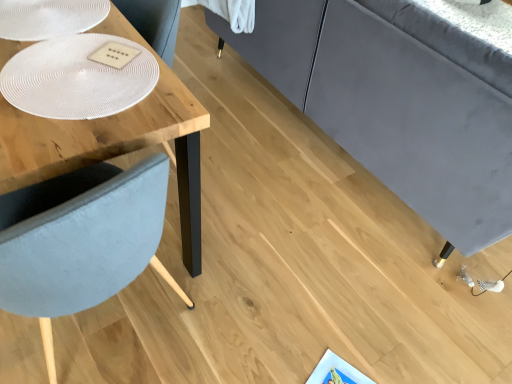
Locate an element on the screen. white textured glass plate at upper left, the 1th glass plate when ordered from top to bottom is located at coordinates (49, 18).

Locate an element on the screen. Image resolution: width=512 pixels, height=384 pixels. white textured glass plate at upper left, marked as the first glass plate in a bottom-to-top arrangement is located at coordinates point(79,77).

This screenshot has width=512, height=384. I want to click on wooden table at left, so click(x=113, y=140).

The width and height of the screenshot is (512, 384). Find the location of `white textured glass plate at upper left, which is the 2th glass plate in bottom-to-top order`. white textured glass plate at upper left, which is the 2th glass plate in bottom-to-top order is located at coordinates (49, 18).

This screenshot has width=512, height=384. In order to click on the 1st glass plate located above the wooden table at left (from a real-world perspective) in this screenshot , I will do `click(49, 18)`.

Is white textured glass plate at upper left, the 1th glass plate when ordered from top to bottom, far from wooden table at left?

Actually, white textured glass plate at upper left, the 1th glass plate when ordered from top to bottom, and wooden table at left are a little close together.

From the image's perspective, which one is positioned higher, white textured glass plate at upper left, which is the 2th glass plate in bottom-to-top order, or wooden table at left?

white textured glass plate at upper left, which is the 2th glass plate in bottom-to-top order, appears higher in the image.

Does white textured glass plate at upper left, the 1th glass plate when ordered from top to bottom, appear on the left side of wooden table at left?

Correct, you'll find white textured glass plate at upper left, the 1th glass plate when ordered from top to bottom, to the left of wooden table at left.

Measure the distance from white textured glass plate at upper left, marked as the first glass plate in a bottom-to-top arrangement, to white textured glass plate at upper left, which is the 2th glass plate in bottom-to-top order.

white textured glass plate at upper left, marked as the first glass plate in a bottom-to-top arrangement, and white textured glass plate at upper left, which is the 2th glass plate in bottom-to-top order, are 8.42 inches apart from each other.

Does white textured glass plate at upper left, marked as the first glass plate in a bottom-to-top arrangement, have a lesser width compared to white textured glass plate at upper left, which is the 2th glass plate in bottom-to-top order?

No.

Considering the positions of objects white textured glass plate at upper left, marked as the second glass plate in a top-to-bottom arrangement, and white textured glass plate at upper left, the 1th glass plate when ordered from top to bottom, in the image provided, who is more to the left, white textured glass plate at upper left, marked as the second glass plate in a top-to-bottom arrangement, or white textured glass plate at upper left, the 1th glass plate when ordered from top to bottom,?

From the viewer's perspective, white textured glass plate at upper left, the 1th glass plate when ordered from top to bottom, appears more on the left side.

Could you tell me if white textured glass plate at upper left, marked as the second glass plate in a top-to-bottom arrangement, is turned towards white textured glass plate at upper left, which is the 2th glass plate in bottom-to-top order?

No, white textured glass plate at upper left, marked as the second glass plate in a top-to-bottom arrangement, does not turn towards white textured glass plate at upper left, which is the 2th glass plate in bottom-to-top order.

Is white textured glass plate at upper left, which is the 2th glass plate in bottom-to-top order, facing away from white textured glass plate at upper left, marked as the first glass plate in a bottom-to-top arrangement?

No, white textured glass plate at upper left, which is the 2th glass plate in bottom-to-top order, is not facing away from white textured glass plate at upper left, marked as the first glass plate in a bottom-to-top arrangement.

Are white textured glass plate at upper left, the 1th glass plate when ordered from top to bottom, and white textured glass plate at upper left, marked as the first glass plate in a bottom-to-top arrangement, making contact?

They are not placed beside each other.

Which is less distant, [88,23] or [24,68]?

Point [88,23].

From a real-world perspective, which object stands above the other?

white textured glass plate at upper left, marked as the second glass plate in a top-to-bottom arrangement, from a real-world perspective.

In the scene shown: Can you tell me how much wooden table at left and white textured glass plate at upper left, marked as the second glass plate in a top-to-bottom arrangement, differ in facing direction?

174 degrees.

Which is behind, wooden table at left or white textured glass plate at upper left, marked as the second glass plate in a top-to-bottom arrangement?

wooden table at left is further from the camera.

Who is bigger, wooden table at left or white textured glass plate at upper left, marked as the first glass plate in a bottom-to-top arrangement?

wooden table at left.

From a real-world perspective, between wooden table at left and white textured glass plate at upper left, which is the 2th glass plate in bottom-to-top order, who is vertically lower?

wooden table at left.

Is point (141, 114) farther from viewer compared to point (47, 1)?

No.

From the image's perspective, is wooden table at left on white textured glass plate at upper left, which is the 2th glass plate in bottom-to-top order?

No, from the image's perspective, wooden table at left is not on top of white textured glass plate at upper left, which is the 2th glass plate in bottom-to-top order.

Who is taller, wooden table at left or white textured glass plate at upper left, the 1th glass plate when ordered from top to bottom?

wooden table at left is taller.

Consider the image. Is white textured glass plate at upper left, marked as the second glass plate in a top-to-bottom arrangement, closer to the viewer compared to wooden table at left?

That is True.

Does point (125, 53) appear closer or farther from the camera than point (41, 131)?

Point (125, 53) is farther from the camera than point (41, 131).

From the picture: Can you confirm if white textured glass plate at upper left, marked as the first glass plate in a bottom-to-top arrangement, is positioned to the right of wooden table at left?

Indeed, white textured glass plate at upper left, marked as the first glass plate in a bottom-to-top arrangement, is positioned on the right side of wooden table at left.

This screenshot has height=384, width=512. I want to click on table located behind the white textured glass plate at upper left, marked as the first glass plate in a bottom-to-top arrangement, so click(x=113, y=140).

Locate an element on the screen. table directly beneath the white textured glass plate at upper left, which is the 2th glass plate in bottom-to-top order (from a real-world perspective) is located at coordinates (113, 140).

You are a GUI agent. You are given a task and a screenshot of the screen. Output one action in this format:
    pyautogui.click(x=<x>, y=<y>)
    Task: Click on the glass plate that is on the right side of white textured glass plate at upper left, the 1th glass plate when ordered from top to bottom
    
    Given the screenshot: What is the action you would take?
    pyautogui.click(x=79, y=77)

Considering their positions, is white textured glass plate at upper left, marked as the second glass plate in a top-to-bottom arrangement, positioned closer to wooden table at left than white textured glass plate at upper left, the 1th glass plate when ordered from top to bottom?

Based on the image, white textured glass plate at upper left, marked as the second glass plate in a top-to-bottom arrangement, appears to be nearer to wooden table at left.

Based on the photo, when comparing their distances from white textured glass plate at upper left, which is the 2th glass plate in bottom-to-top order, does wooden table at left or white textured glass plate at upper left, marked as the second glass plate in a top-to-bottom arrangement, seem closer?

wooden table at left.

Considering their positions, is white textured glass plate at upper left, marked as the second glass plate in a top-to-bottom arrangement, positioned further to white textured glass plate at upper left, which is the 2th glass plate in bottom-to-top order, than wooden table at left?

Among the two, white textured glass plate at upper left, marked as the second glass plate in a top-to-bottom arrangement, is located further to white textured glass plate at upper left, which is the 2th glass plate in bottom-to-top order.

When comparing their distances from white textured glass plate at upper left, marked as the second glass plate in a top-to-bottom arrangement, does white textured glass plate at upper left, the 1th glass plate when ordered from top to bottom, or wooden table at left seem closer?

wooden table at left.

Estimate the real-world distances between objects in this image. Which object is further from white textured glass plate at upper left, marked as the first glass plate in a bottom-to-top arrangement, wooden table at left or white textured glass plate at upper left, the 1th glass plate when ordered from top to bottom?

white textured glass plate at upper left, the 1th glass plate when ordered from top to bottom, is further to white textured glass plate at upper left, marked as the first glass plate in a bottom-to-top arrangement.

Based on their spatial positions, is white textured glass plate at upper left, the 1th glass plate when ordered from top to bottom, or white textured glass plate at upper left, marked as the first glass plate in a bottom-to-top arrangement, closer to wooden table at left?

Among the two, white textured glass plate at upper left, marked as the first glass plate in a bottom-to-top arrangement, is located nearer to wooden table at left.

Where is `table between white textured glass plate at upper left, the 1th glass plate when ordered from top to bottom, and white textured glass plate at upper left, marked as the first glass plate in a bottom-to-top arrangement, from top to bottom`? The width and height of the screenshot is (512, 384). table between white textured glass plate at upper left, the 1th glass plate when ordered from top to bottom, and white textured glass plate at upper left, marked as the first glass plate in a bottom-to-top arrangement, from top to bottom is located at coordinates (113, 140).